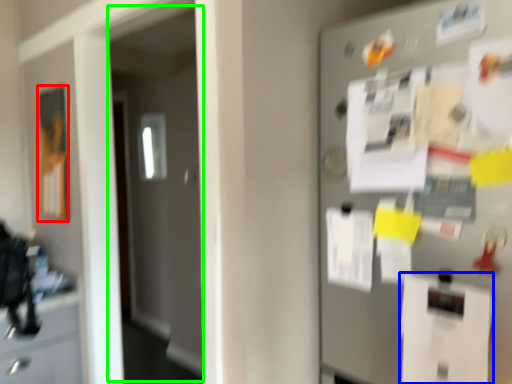
Question: Which is farther away from poster (highlighted by a red box)? paper (highlighted by a blue box) or glass door (highlighted by a green box)?

Choices:
 (A) paper
 (B) glass door

Answer: (A)